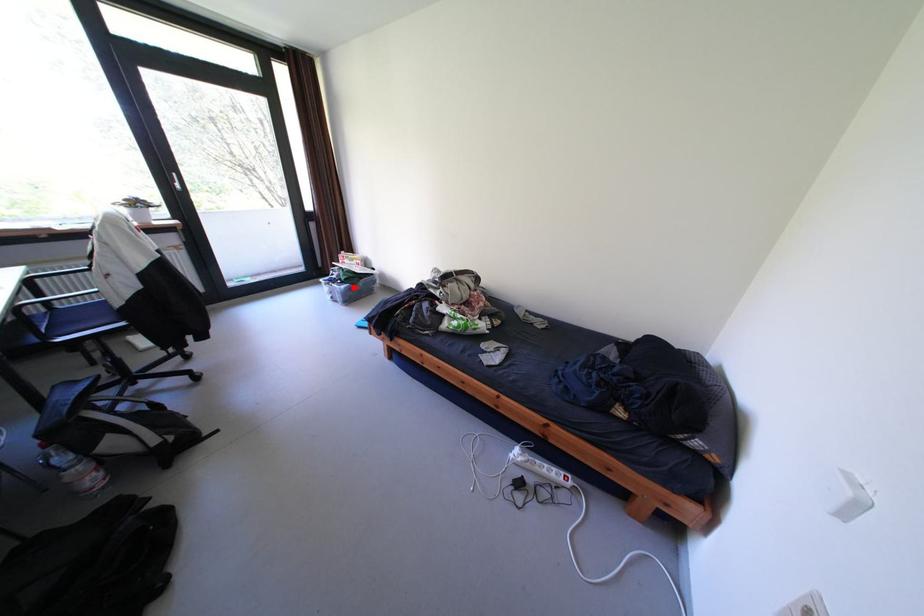
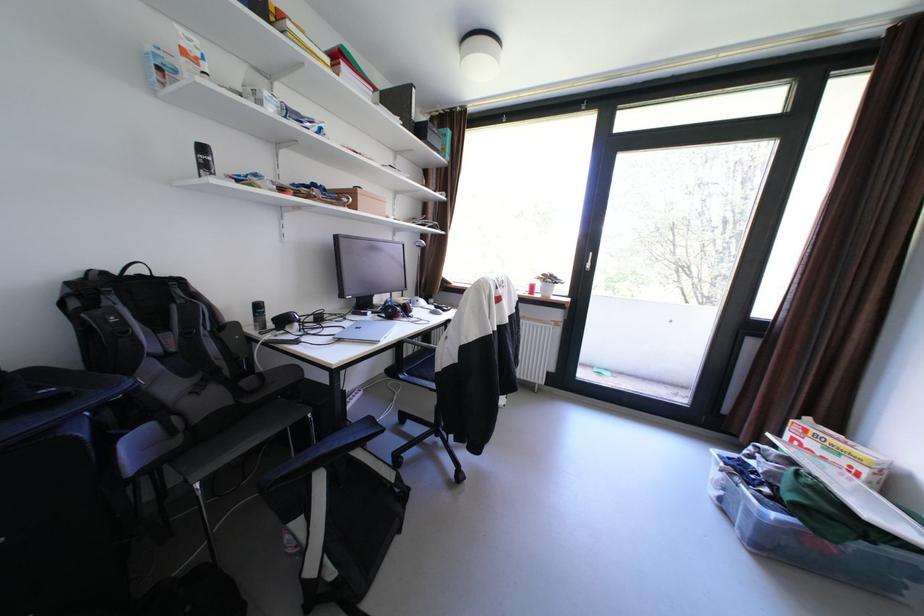
Question: I am providing you with two images of the same scene from different viewpoints. Given a red point in image1, look at the same physical point in image2. Is it:

Choices:
 (A) Closer to the viewpoint
 (B) Farther from the viewpoint

Answer: (A)